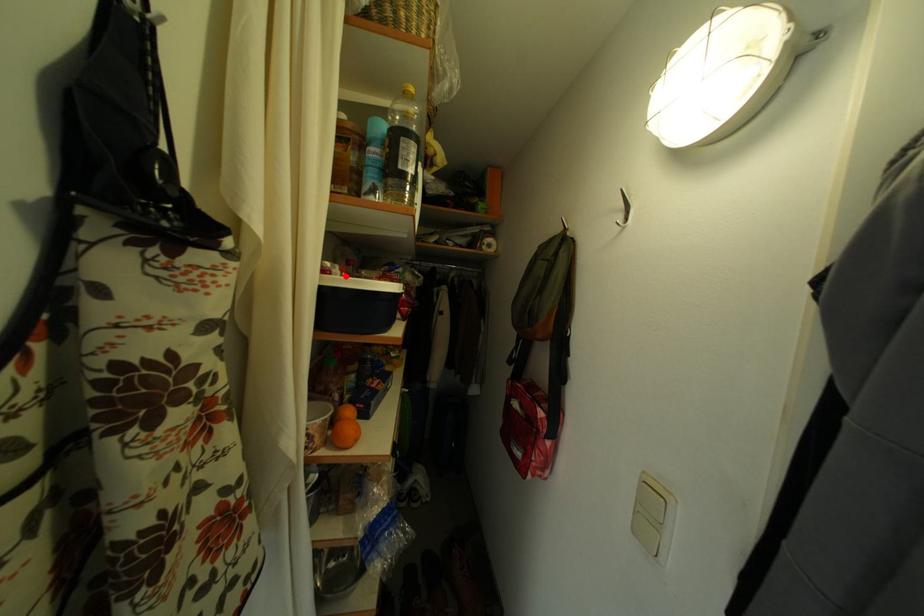
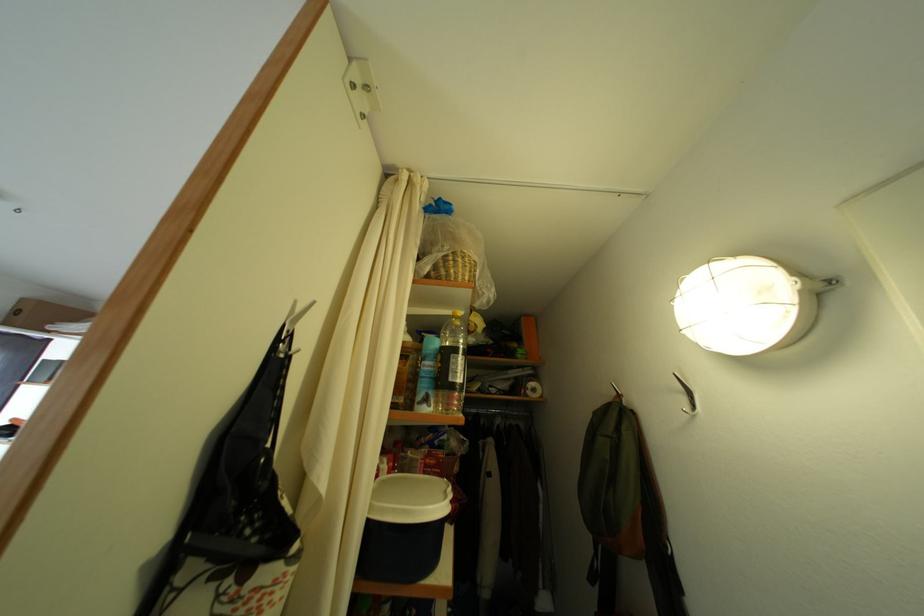
Question: I am providing you with two images of the same scene from different viewpoints. A red point is marked on the first image. Is the red point's position out of view in image 2?

Choices:
 (A) Yes
 (B) No

Answer: (B)